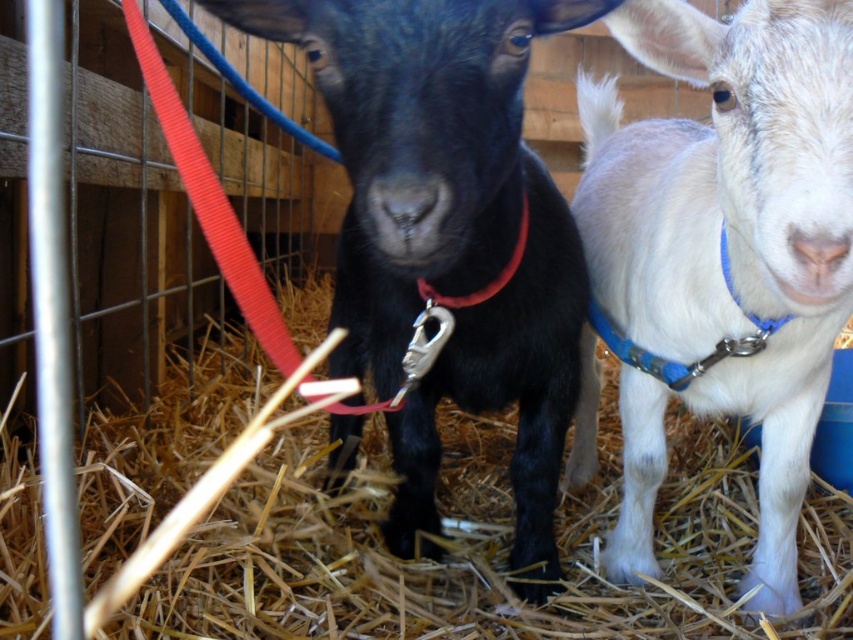
Measure the distance from shiny black goat at center to matte red collar at center.

The distance of shiny black goat at center from matte red collar at center is 8.99 inches.

Does shiny black goat at center lie behind matte red collar at center?

No, shiny black goat at center is closer to the viewer.

Locate an element on the screen. This screenshot has width=853, height=640. shiny black goat at center is located at coordinates (447, 232).

Is straw at center above matte red collar at center?

Incorrect, straw at center is not positioned above matte red collar at center.

Can you confirm if straw at center is positioned to the left of matte red collar at center?

Indeed, straw at center is positioned on the left side of matte red collar at center.

Locate an element on the screen. The width and height of the screenshot is (853, 640). straw at center is located at coordinates (453, 547).

The width and height of the screenshot is (853, 640). What are the coordinates of `straw at center` in the screenshot? It's located at (453, 547).

Who is positioned more to the left, white woolen goat at center or matte red collar at center?

matte red collar at center is more to the left.

Is point (662, 186) positioned after point (491, 291)?

Yes, point (662, 186) is behind point (491, 291).

You are a GUI agent. You are given a task and a screenshot of the screen. Output one action in this format:
    pyautogui.click(x=<x>, y=<y>)
    Task: Click on the white woolen goat at center
    
    Given the screenshot: What is the action you would take?
    pyautogui.click(x=732, y=227)